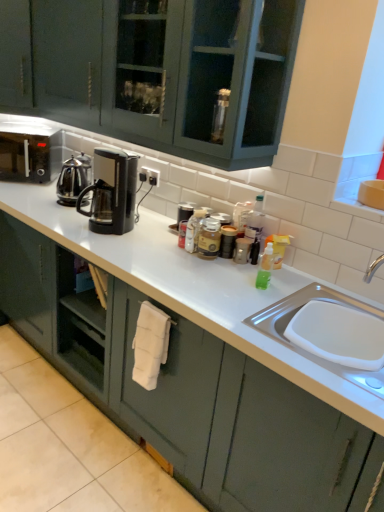
This screenshot has height=512, width=384. I want to click on vacant space that is to the left of metallic silver canister at center, the first appliance positioned from the right, so click(212, 263).